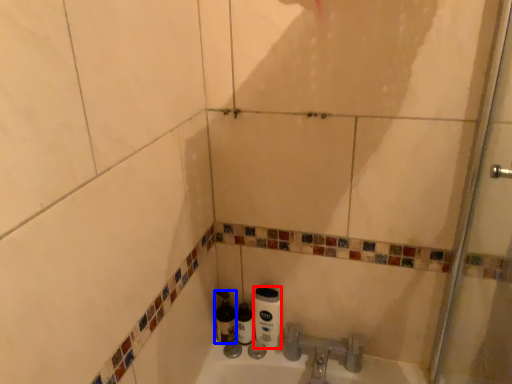
Question: Among these objects, which one is nearest to the camera, toilet paper (highlighted by a red box) or bottle (highlighted by a blue box)?

Choices:
 (A) toilet paper
 (B) bottle

Answer: (A)